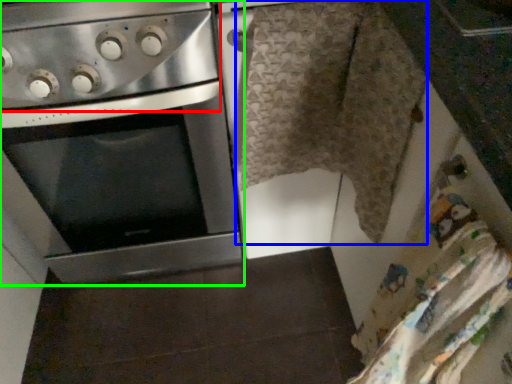
Question: Based on their relative distances, which object is nearer to gas stove (highlighted by a red box)? Choose from blanket (highlighted by a blue box) and oven (highlighted by a green box).

Choices:
 (A) blanket
 (B) oven

Answer: (B)